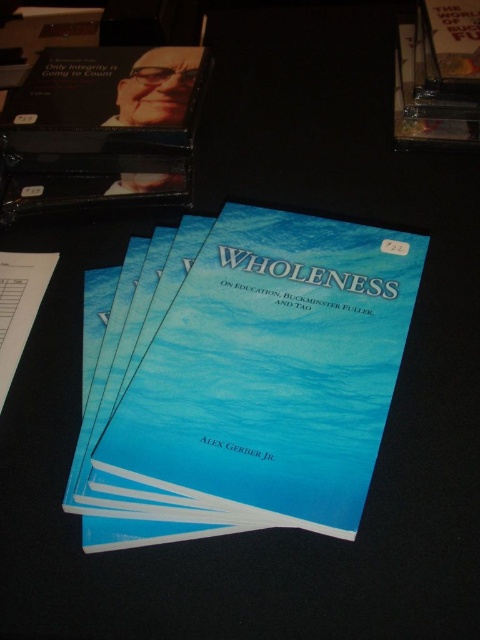
Between blue paper book at center and gold metallic book at upper right, which one is positioned lower?

blue paper book at center

Is point (406, 243) farther from camera compared to point (406, 120)?

No, (406, 243) is in front of (406, 120).

This screenshot has width=480, height=640. Find the location of `blue paper book at center`. blue paper book at center is located at coordinates (261, 385).

Based on the photo, is matte black book at upper left positioned before gold metallic book at upper right?

Yes, matte black book at upper left is in front of gold metallic book at upper right.

Between matte black book at upper left and gold metallic book at upper right, which one has less height?

gold metallic book at upper right

Does point (57, 60) come in front of point (432, 141)?

No, (57, 60) is behind (432, 141).

Find the location of a particular element. matte black book at upper left is located at coordinates (99, 125).

Is blue paper book at center shorter than matte black book at upper left?

In fact, blue paper book at center may be taller than matte black book at upper left.

Does blue paper book at center have a greater width compared to matte black book at upper left?

Yes.

Between point (408, 252) and point (20, 109), which one is positioned in front?

Point (408, 252)

Identify the location of blue paper book at center. (261, 385).